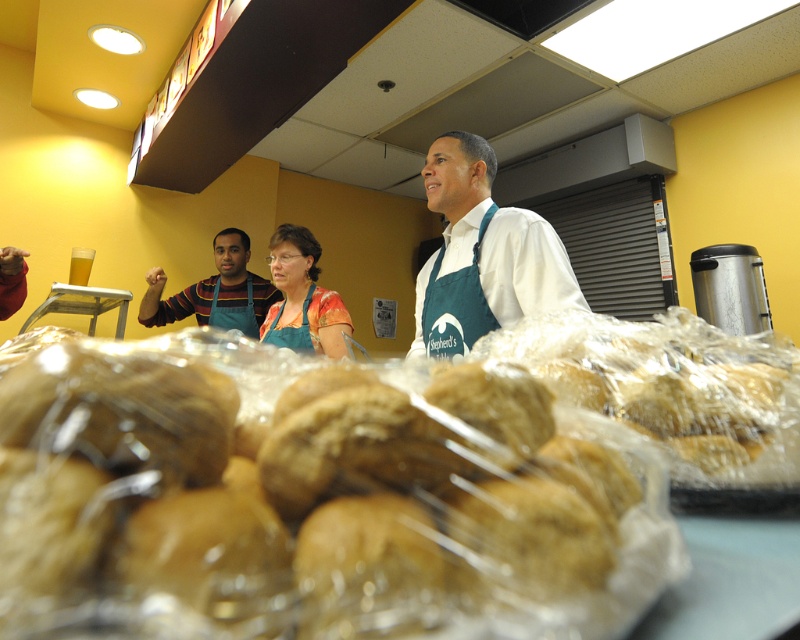
Question: Is golden brown bread at center positioned at the back of matte blue apron at center?

Choices:
 (A) no
 (B) yes

Answer: (A)

Question: Can you confirm if golden brown bread at center is positioned to the right of matte blue apron at center?

Choices:
 (A) yes
 (B) no

Answer: (A)

Question: Which object appears farthest from the camera in this image?

Choices:
 (A) matte blue apron at center
 (B) white matte apron at upper center
 (C) matte green apron at center
 (D) golden brown bread at center

Answer: (A)

Question: Where is white matte apron at upper center located in relation to matte blue apron at center in the image?

Choices:
 (A) above
 (B) below

Answer: (B)

Question: Which object appears farthest from the camera in this image?

Choices:
 (A) matte green apron at center
 (B) white matte apron at upper center
 (C) matte blue apron at center
 (D) golden brown bread at center

Answer: (C)

Question: Which of the following is the farthest from the observer?

Choices:
 (A) matte blue apron at center
 (B) white matte apron at upper center

Answer: (A)